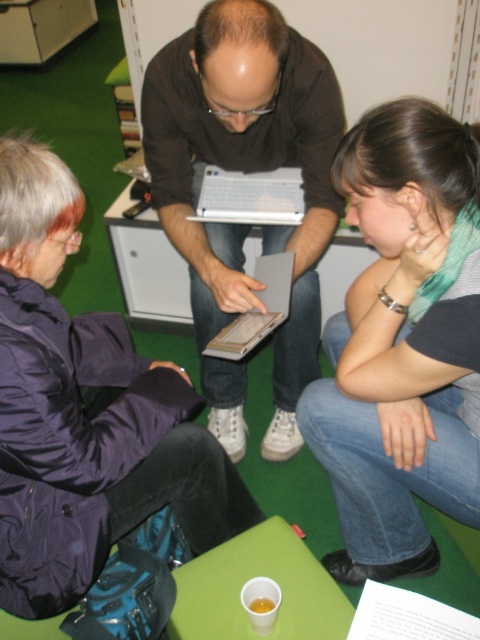
Question: Which point is closer to the camera?

Choices:
 (A) tap(199, 209)
 (B) tap(230, 259)

Answer: (B)

Question: Among these objects, which one is nearest to the camera?

Choices:
 (A) satin silver laptop at center
 (B) purple satin jacket at upper left

Answer: (B)

Question: Considering the relative positions of purple satin jacket at upper left and matte black laptop at center in the image provided, where is purple satin jacket at upper left located with respect to matte black laptop at center?

Choices:
 (A) above
 (B) below

Answer: (B)

Question: Is purple satin jacket at upper left closer to the viewer compared to silver metallic laptop at center?

Choices:
 (A) no
 (B) yes

Answer: (B)

Question: Is matte black laptop at center smaller than satin silver laptop at center?

Choices:
 (A) yes
 (B) no

Answer: (B)

Question: Which point is closer to the camera taking this photo?

Choices:
 (A) (176, 177)
 (B) (260, 196)
 (C) (4, 576)
 (D) (372, 388)

Answer: (C)